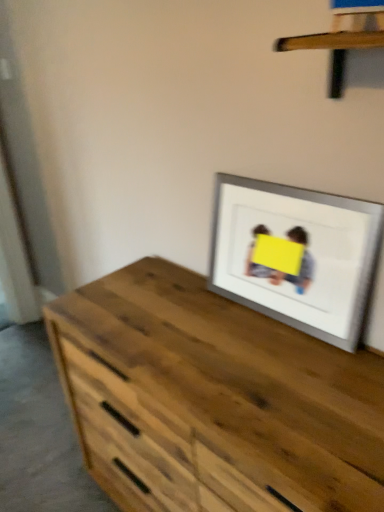
Question: Is wooden at upper center completely or partially inside silver/metallic picture frame at upper right?

Choices:
 (A) yes
 (B) no

Answer: (B)

Question: Is silver/metallic picture frame at upper right turned away from wooden at upper center?

Choices:
 (A) no
 (B) yes

Answer: (A)

Question: From a real-world perspective, is silver/metallic picture frame at upper right physically below wooden at upper center?

Choices:
 (A) yes
 (B) no

Answer: (A)

Question: Is there a large distance between silver/metallic picture frame at upper right and wooden at upper center?

Choices:
 (A) yes
 (B) no

Answer: (B)

Question: From the image's perspective, would you say silver/metallic picture frame at upper right is shown under wooden at upper center?

Choices:
 (A) no
 (B) yes

Answer: (B)

Question: Visually, is wooden at upper center positioned to the left or to the right of wooden chest of drawers at center?

Choices:
 (A) right
 (B) left

Answer: (A)

Question: Is point (362, 18) closer or farther from the camera than point (64, 310)?

Choices:
 (A) farther
 (B) closer

Answer: (B)

Question: Is wooden at upper center in front of or behind wooden chest of drawers at center in the image?

Choices:
 (A) behind
 (B) front

Answer: (B)

Question: From the image's perspective, is wooden at upper center positioned above or below wooden chest of drawers at center?

Choices:
 (A) above
 (B) below

Answer: (A)

Question: In terms of size, does silver/metallic picture frame at upper right appear bigger or smaller than wooden chest of drawers at center?

Choices:
 (A) small
 (B) big

Answer: (A)

Question: Choose the correct answer: Is silver/metallic picture frame at upper right inside wooden chest of drawers at center or outside it?

Choices:
 (A) outside
 (B) inside

Answer: (A)

Question: Is silver/metallic picture frame at upper right to the left or to the right of wooden chest of drawers at center in the image?

Choices:
 (A) right
 (B) left

Answer: (A)

Question: Considering the positions of silver/metallic picture frame at upper right and wooden chest of drawers at center in the image, is silver/metallic picture frame at upper right taller or shorter than wooden chest of drawers at center?

Choices:
 (A) tall
 (B) short

Answer: (B)

Question: Is silver/metallic picture frame at upper right taller or shorter than wooden at upper center?

Choices:
 (A) tall
 (B) short

Answer: (A)

Question: Considering their positions, is silver/metallic picture frame at upper right located in front of or behind wooden at upper center?

Choices:
 (A) front
 (B) behind

Answer: (B)